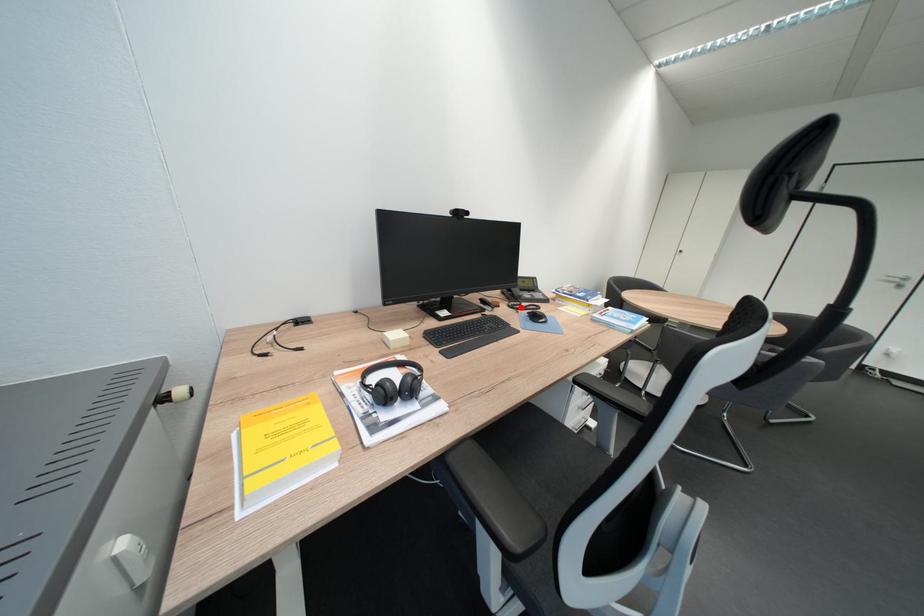
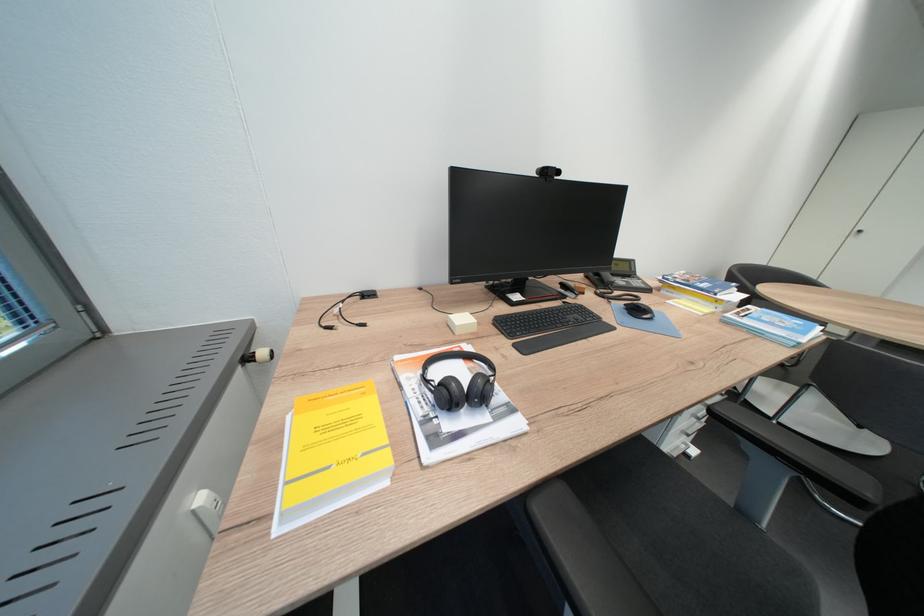
Where in the second image is the point corresponding to the highlighted location from the first image?

(609, 294)